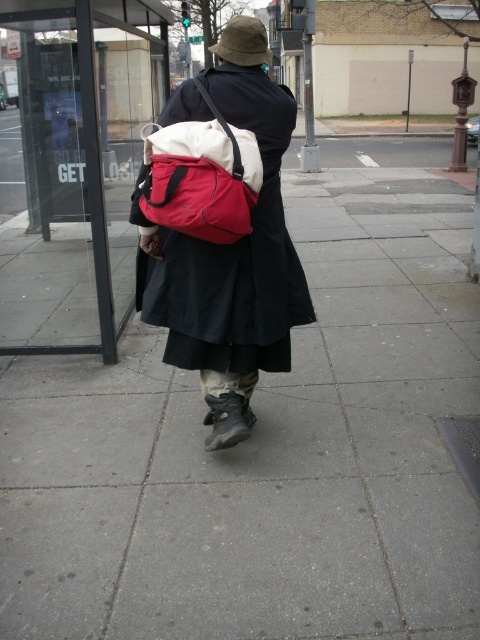
You are a delivery robot with a 1.2 meter wide package. You need to move from your current position on the gray concrete sidewalk at center to the transparent glass bus stop at upper center. Is there enough space between them for you to carry the package without hitting anything?

The gray concrete sidewalk at center and transparent glass bus stop at upper center are 4.43 meters apart from each other. Since the package is 1.2 meters wide, there is sufficient space as the distance between them is greater than the package width.

You are a delivery person who needs to determine if the black matte robe at center can fit into a storage locker that can only accommodate items smaller than the matte nylon backpack at center. Based on the scene, can the robe fit?

The black matte robe at center has a larger size compared to the matte nylon backpack at center. Therefore, the robe cannot fit into the storage locker since it is bigger than the backpack.